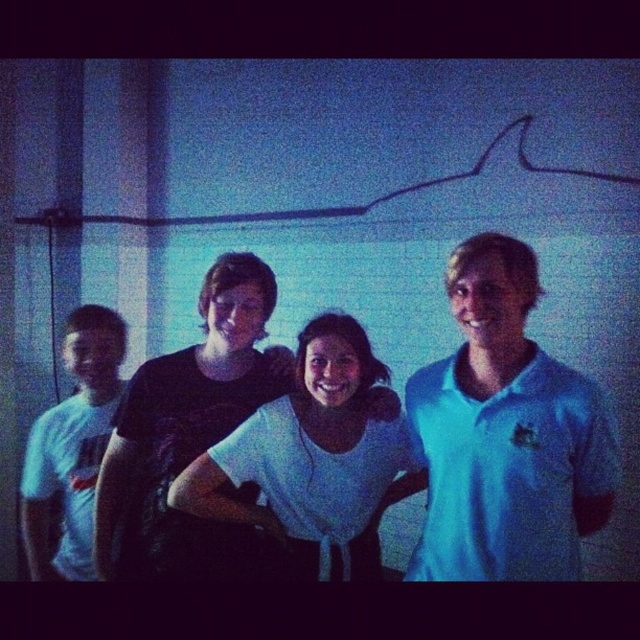
Does point (330, 348) lie behind point (54, 435)?

No, it is not.

The height and width of the screenshot is (640, 640). Describe the element at coordinates (314, 458) in the screenshot. I see `white soft cotton shirt at center` at that location.

You are a GUI agent. You are given a task and a screenshot of the screen. Output one action in this format:
    pyautogui.click(x=<x>, y=<y>)
    Task: Click on the white soft cotton shirt at center
    The image size is (640, 640).
    Given the screenshot: What is the action you would take?
    pyautogui.click(x=314, y=458)

Can you confirm if white matte polo shirt at right is positioned above white t-shirt at left?

Yes, white matte polo shirt at right is above white t-shirt at left.

Does white matte polo shirt at right have a greater height compared to white t-shirt at left?

No, white matte polo shirt at right is not taller than white t-shirt at left.

Between point (570, 516) and point (116, 336), which one is positioned in front?

Positioned in front is point (570, 516).

Find the location of a particular element. Image resolution: width=640 pixels, height=640 pixels. white matte polo shirt at right is located at coordinates [x=508, y=468].

Between point (460, 426) and point (253, 440), which one is positioned behind?

Positioned behind is point (253, 440).

Is the position of white matte polo shirt at right less distant than that of white soft cotton shirt at center?

Yes, it is.

Who is more distant from viewer, (502,429) or (227,509)?

The point (227,509) is more distant.

In order to click on white matte polo shirt at right in this screenshot , I will do `click(508, 468)`.